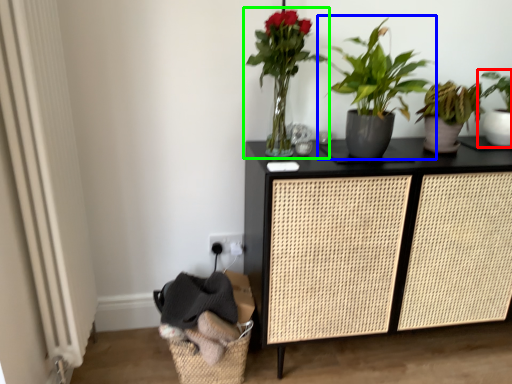
Question: Estimate the real-world distances between objects in this image. Which object is farther from houseplant (highlighted by a red box), houseplant (highlighted by a blue box) or houseplant (highlighted by a green box)?

Choices:
 (A) houseplant
 (B) houseplant

Answer: (B)